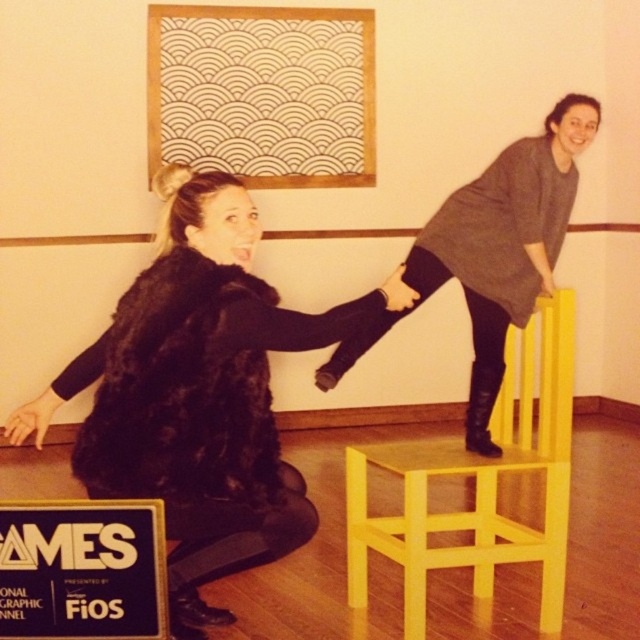
How much distance is there between yellow matte chair at upper right and smooth black hand at lower left?

A distance of 1.54 meters exists between yellow matte chair at upper right and smooth black hand at lower left.

Does yellow matte chair at upper right have a larger size compared to smooth black hand at lower left?

Yes.

Does point (481, 458) come closer to viewer compared to point (17, 440)?

No, it is behind (17, 440).

Identify the location of yellow matte chair at upper right. The width and height of the screenshot is (640, 640). (477, 483).

Which is in front, point (554, 337) or point (552, 291)?

Point (554, 337) is more forward.

Is yellow matte chair at upper right below matte black hand at upper right?

Yes, yellow matte chair at upper right is below matte black hand at upper right.

Who is more forward, (548, 326) or (547, 284)?

Point (548, 326) is in front.

Where is `yellow matte chair at upper right`? This screenshot has width=640, height=640. yellow matte chair at upper right is located at coordinates (477, 483).

Between matte black hand at upper center and matte black hand at upper right, which one has less height?

With less height is matte black hand at upper right.

Can you confirm if matte black hand at upper center is shorter than matte black hand at upper right?

No, matte black hand at upper center is not shorter than matte black hand at upper right.

Does point (396, 280) come in front of point (552, 289)?

Yes, it is in front of point (552, 289).

The width and height of the screenshot is (640, 640). In order to click on matte black hand at upper center in this screenshot , I will do `click(397, 291)`.